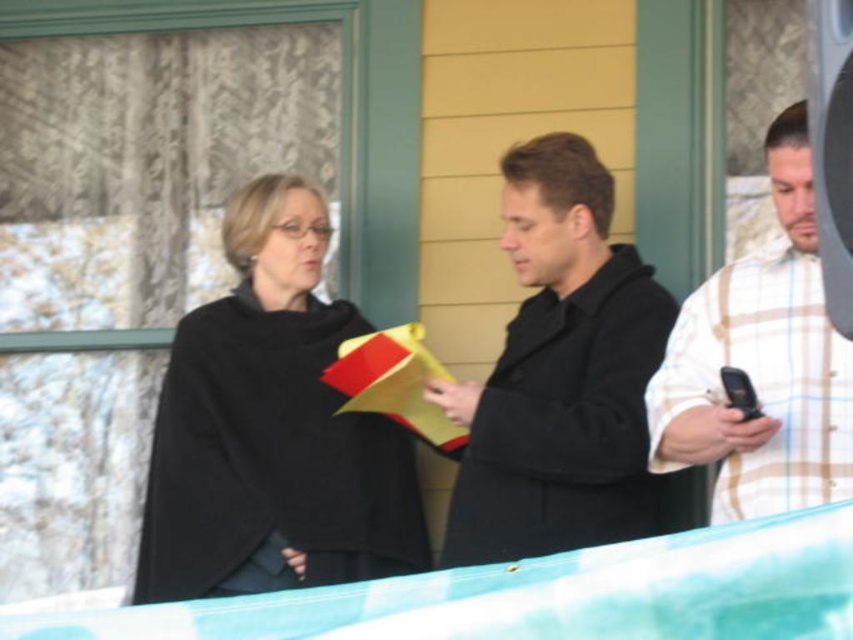
Can you confirm if black matte shawl at center is smaller than white plaid shirt at right?

No.

Looking at this image, is black matte shawl at center bigger than white plaid shirt at right?

Yes.

At what (x,y) coordinates should I click in order to perform the action: click on black matte shawl at center. Please return your answer as a coordinate pair (x, y). The image size is (853, 640). Looking at the image, I should click on (271, 429).

Where is `black matte shawl at center`? This screenshot has height=640, width=853. black matte shawl at center is located at coordinates (271, 429).

Does black matte shawl at center come in front of matte black coat at center?

No.

Is black matte shawl at center behind matte black coat at center?

Yes, black matte shawl at center is behind matte black coat at center.

Which is behind, point (254, 180) or point (508, 337)?

The point (254, 180) is more distant.

Image resolution: width=853 pixels, height=640 pixels. I want to click on black matte shawl at center, so click(x=271, y=429).

Is matte black coat at center further to the viewer compared to white plaid shirt at right?

Yes, it is.

Which is behind, point (614, 342) or point (737, 452)?

The point (614, 342) is more distant.

You are a GUI agent. You are given a task and a screenshot of the screen. Output one action in this format:
    pyautogui.click(x=<x>, y=<y>)
    Task: Click on the matte black coat at center
    The width and height of the screenshot is (853, 640).
    Given the screenshot: What is the action you would take?
    pyautogui.click(x=561, y=376)